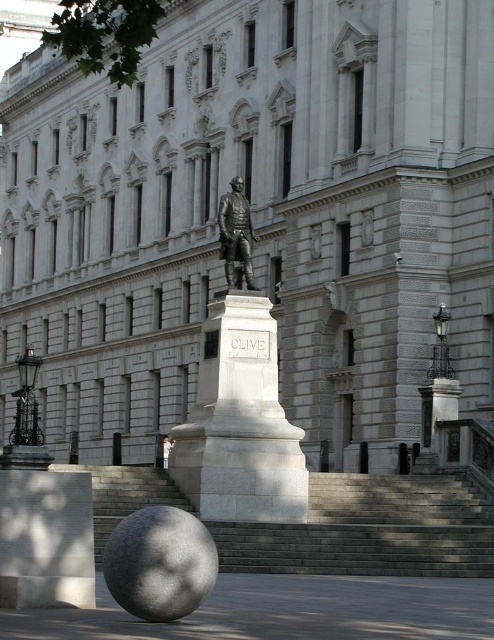
You are an architect planning to place a new sculpture in the courtyard between the bronze statue at center and the white marble statue at center. Which statue should you position closer to the building to ensure enough space for the sculpture?

The bronze statue at center occupies less space than the white marble statue at center, so positioning the bronze statue closer to the building would leave more space for the sculpture between them.

You are standing at the entrance of the grand building and want to reach the statue in front of it. According to the image, which direction should you move relative to the gray stone stairs at center?

Since the gray stone stairs at center are located at point (370, 531), you should move forward towards the statue, which is in front of the building and not obstructed by the stairs.